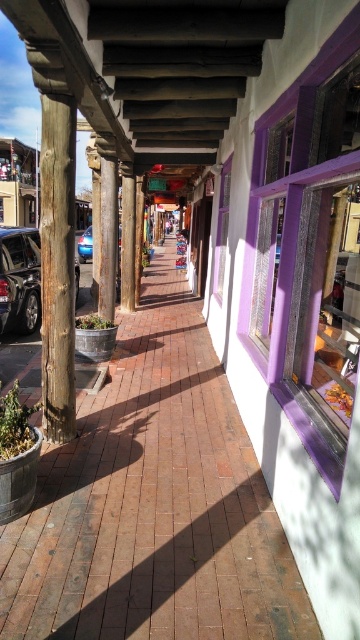
Question: Which object is closer to the camera taking this photo?

Choices:
 (A) shiny blue sedan at center
 (B) matte black car at left
 (C) brick pavement at center
 (D) weathered wood post at left

Answer: (C)

Question: Which point appears farthest from the camera in this image?

Choices:
 (A) (47, 349)
 (B) (2, 248)

Answer: (B)

Question: Is weathered wood post at left above matte black car at left?

Choices:
 (A) yes
 (B) no

Answer: (B)

Question: Is brick pavement at center to the left of shiny blue sedan at center from the viewer's perspective?

Choices:
 (A) yes
 (B) no

Answer: (B)

Question: Can you confirm if brick pavement at center is smaller than matte black car at left?

Choices:
 (A) no
 (B) yes

Answer: (A)

Question: Which is nearer to the brick pavement at center?

Choices:
 (A) shiny blue sedan at center
 (B) weathered wood post at left

Answer: (B)